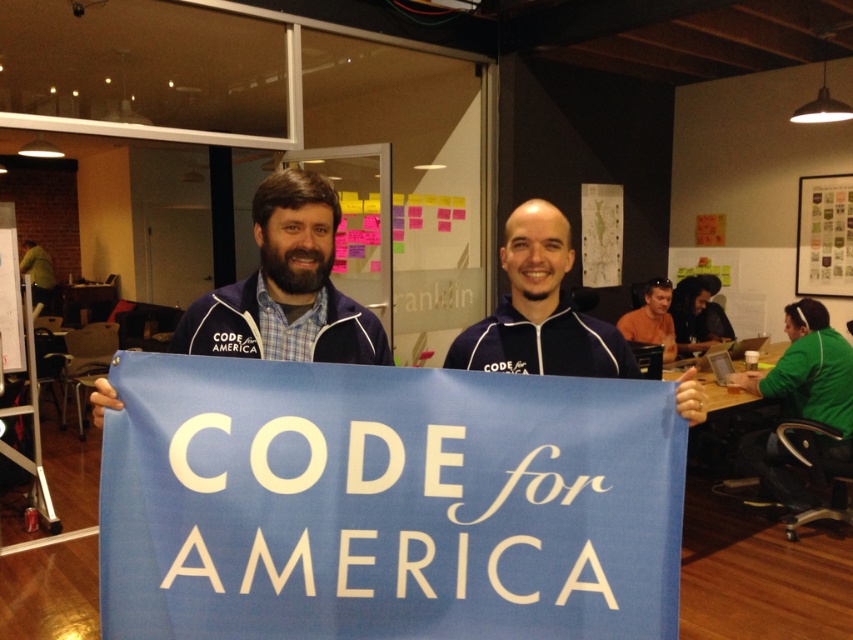
Question: Considering the relative positions of blue fabric sign at center and green fleece jacket at lower right in the image provided, where is blue fabric sign at center located with respect to green fleece jacket at lower right?

Choices:
 (A) left
 (B) right

Answer: (A)

Question: Which point is closer to the camera?

Choices:
 (A) (622, 368)
 (B) (660, 314)
 (C) (413, 500)

Answer: (C)

Question: Which of the following is the closest to the observer?

Choices:
 (A) [793, 388]
 (B) [329, 324]
 (C) [502, 358]

Answer: (B)

Question: Considering the real-world distances, which object is farthest from the matte paper poster at upper right?

Choices:
 (A) green fleece jacket at lower right
 (B) blue fabric at center
 (C) blue fabric sign at center

Answer: (C)

Question: Is green fleece jacket at lower right smaller than orange fabric shirt at upper right?

Choices:
 (A) no
 (B) yes

Answer: (A)

Question: Can you confirm if blue fabric banner at center is positioned to the left of matte paper poster at upper right?

Choices:
 (A) yes
 (B) no

Answer: (A)